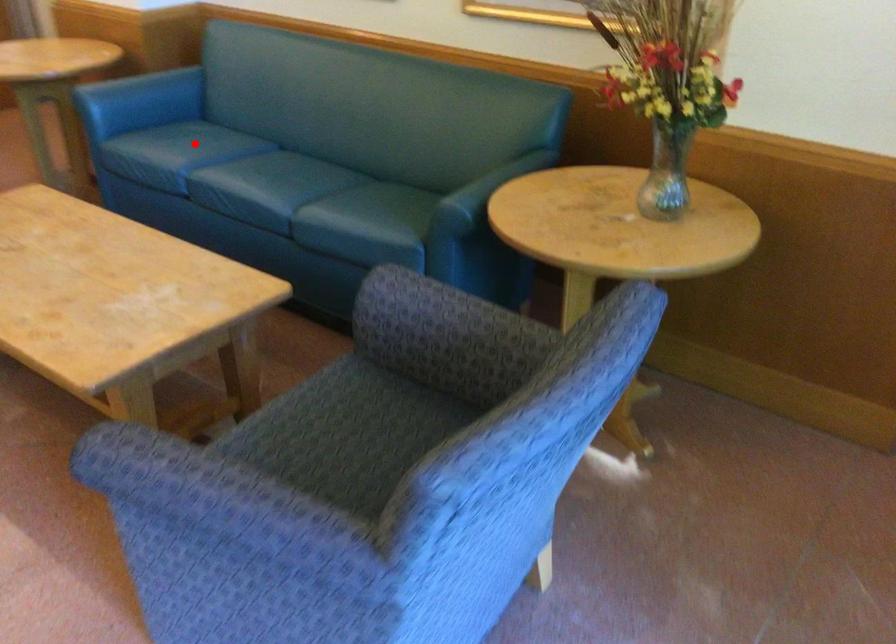
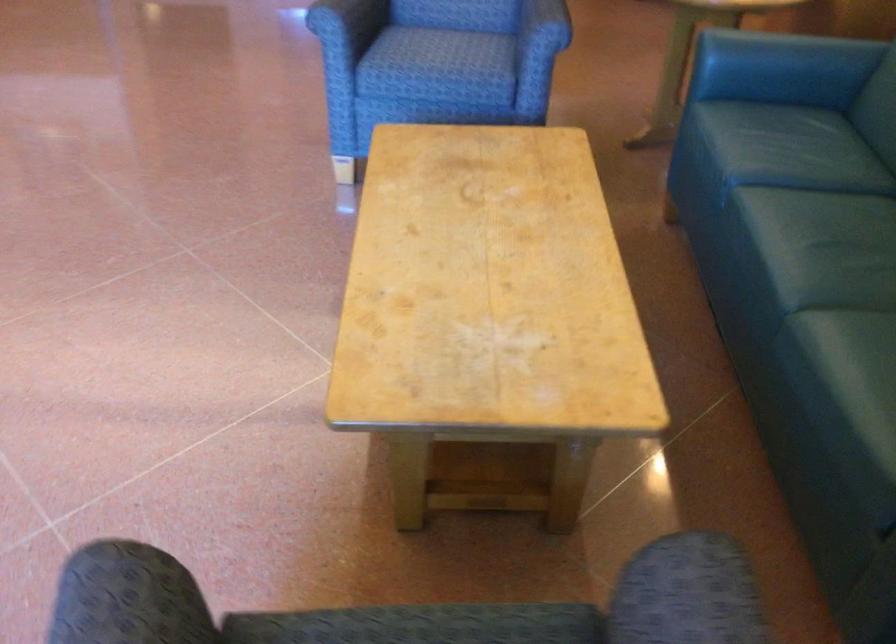
Question: I am providing you with two images of the same scene from different viewpoints. Given a red point in image1, look at the same physical point in image2. Is it:

Choices:
 (A) Closer to the viewpoint
 (B) Farther from the viewpoint

Answer: (A)